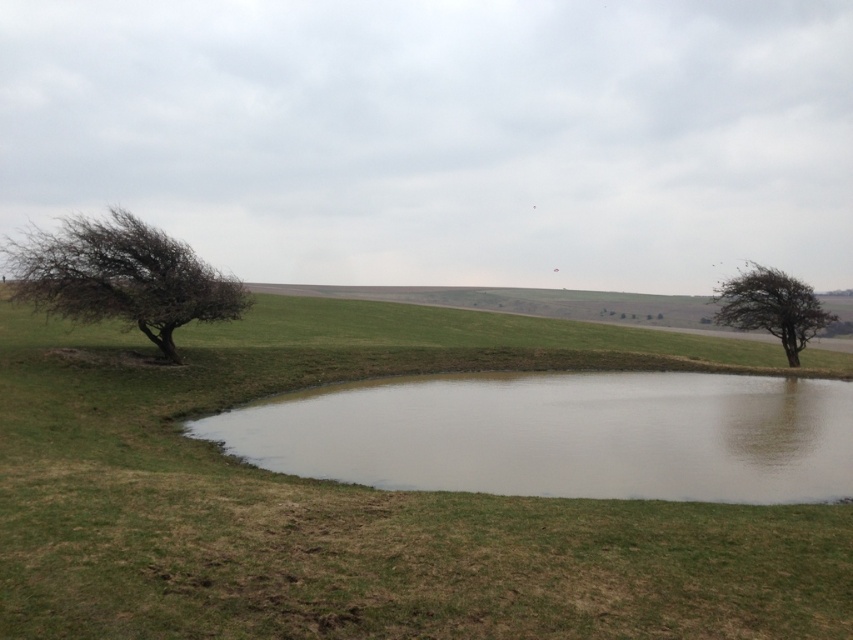
Question: Does clear water at center have a lesser width compared to green leafy tree at right?

Choices:
 (A) no
 (B) yes

Answer: (B)

Question: Which of the following is the closest to the observer?

Choices:
 (A) green leafy tree at right
 (B) green grassy at center
 (C) brown rough tree at left
 (D) clear water at center

Answer: (B)

Question: Which point appears closest to the camera in this image?

Choices:
 (A) (177, 497)
 (B) (817, 481)
 (C) (39, 285)

Answer: (A)

Question: Does green grassy at center appear on the right side of green leafy tree at right?

Choices:
 (A) no
 (B) yes

Answer: (A)

Question: Can you confirm if brown rough tree at left is thinner than green leafy tree at right?

Choices:
 (A) yes
 (B) no

Answer: (B)

Question: Which point is closer to the camera?

Choices:
 (A) (689, 445)
 (B) (819, 307)

Answer: (A)